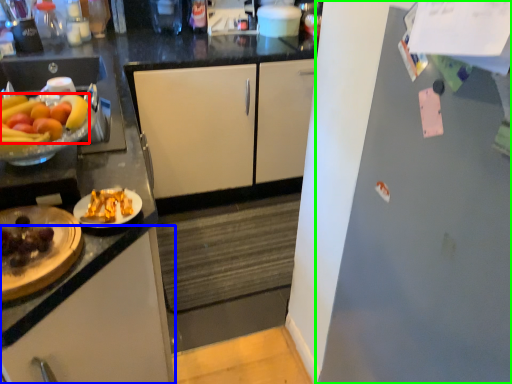
Question: Considering the real-world distances, which object is closest to grapefruit (highlighted by a red box)? cabinetry (highlighted by a blue box) or refrigerator (highlighted by a green box).

Choices:
 (A) cabinetry
 (B) refrigerator

Answer: (A)